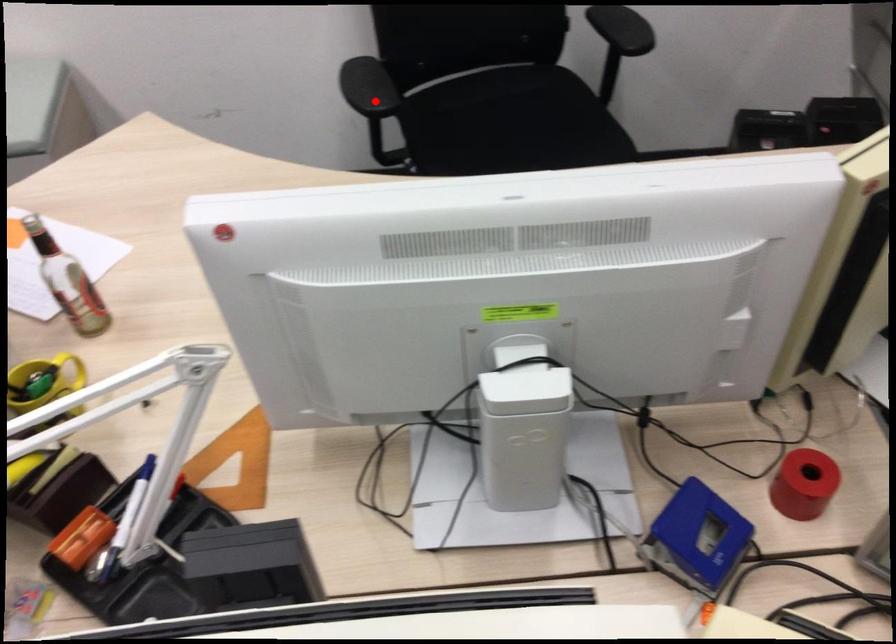
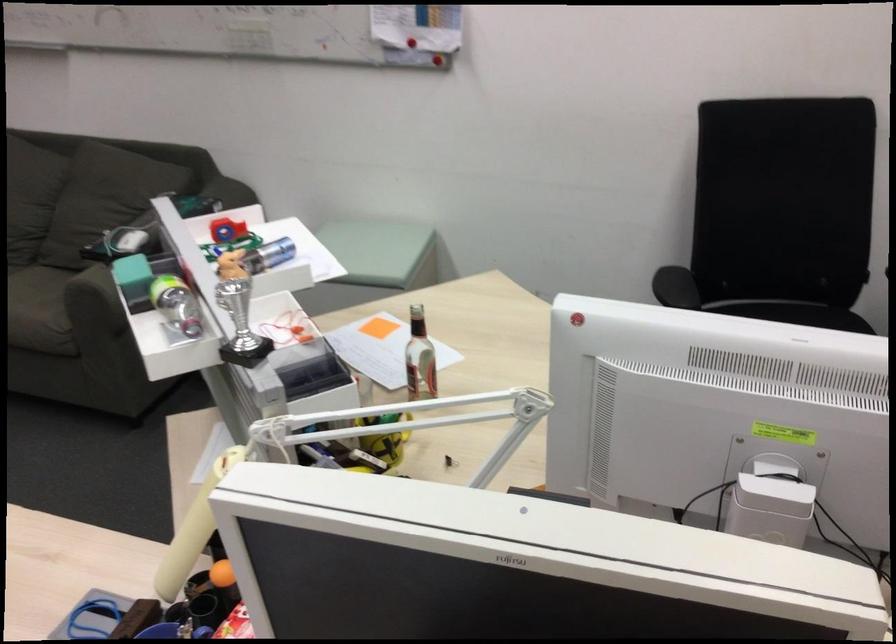
Question: I am providing you with two images of the same scene from different viewpoints. A red point is marked on the first image. Can you still see the location of the red point in image 2?

Choices:
 (A) Yes
 (B) No

Answer: (A)